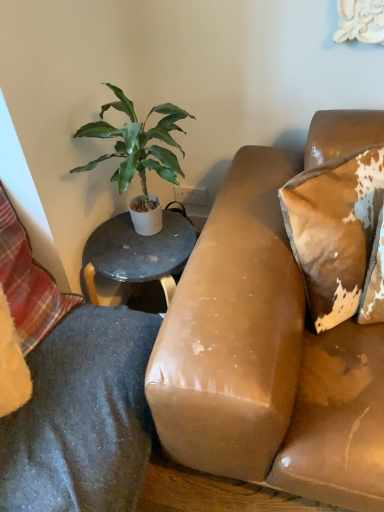
The width and height of the screenshot is (384, 512). Describe the element at coordinates (138, 144) in the screenshot. I see `green leafy plant at upper left` at that location.

This screenshot has width=384, height=512. I want to click on brown distressed leather pillow at upper right, placed as the 2th pillow when sorted from left to right, so click(x=335, y=230).

Where is `plaid fabric pillow at lower left, the 1th pillow viewed from the left`? The width and height of the screenshot is (384, 512). plaid fabric pillow at lower left, the 1th pillow viewed from the left is located at coordinates (28, 282).

Locate an element on the screen. green leafy plant at upper left is located at coordinates (138, 144).

Where is `houseplant above the brown distressed leather pillow at upper right, placed as the 2th pillow when sorted from left to right (from the image's perspective)`? The height and width of the screenshot is (512, 384). houseplant above the brown distressed leather pillow at upper right, placed as the 2th pillow when sorted from left to right (from the image's perspective) is located at coordinates (138, 144).

Can you tell me how much green leafy plant at upper left and brown distressed leather pillow at upper right, positioned as the first pillow in right-to-left order, differ in facing direction?

40.4 degrees.

Is green leafy plant at upper left positioned before brown distressed leather pillow at upper right, positioned as the first pillow in right-to-left order?

No, it is not.

From a real-world perspective, relative to brown distressed leather pillow at upper right, positioned as the first pillow in right-to-left order, is green leafy plant at upper left vertically above or below?

From a real-world perspective, green leafy plant at upper left is physically above brown distressed leather pillow at upper right, positioned as the first pillow in right-to-left order.

Do you think brown distressed leather pillow at upper right, positioned as the first pillow in right-to-left order, is within green leafy plant at upper left, or outside of it?

brown distressed leather pillow at upper right, positioned as the first pillow in right-to-left order, cannot be found inside green leafy plant at upper left.

Does brown distressed leather pillow at upper right, positioned as the first pillow in right-to-left order, appear on the left side of green leafy plant at upper left?

No, brown distressed leather pillow at upper right, positioned as the first pillow in right-to-left order, is not to the left of green leafy plant at upper left.

Is plaid fabric pillow at lower left, placed as the second pillow when sorted from right to left, far away from brown distressed leather pillow at upper right, positioned as the first pillow in right-to-left order?

No, plaid fabric pillow at lower left, placed as the second pillow when sorted from right to left, is not far from brown distressed leather pillow at upper right, positioned as the first pillow in right-to-left order.

Which is correct: plaid fabric pillow at lower left, placed as the second pillow when sorted from right to left, is inside brown distressed leather pillow at upper right, placed as the 2th pillow when sorted from left to right, or outside of it?

plaid fabric pillow at lower left, placed as the second pillow when sorted from right to left, exists outside the volume of brown distressed leather pillow at upper right, placed as the 2th pillow when sorted from left to right.

Does point (28, 266) lie behind point (307, 273)?

Yes, it is.

How far apart are plaid fabric pillow at lower left, placed as the second pillow when sorted from right to left, and brown distressed leather pillow at upper right, placed as the 2th pillow when sorted from left to right?

plaid fabric pillow at lower left, placed as the second pillow when sorted from right to left, is 28.39 inches away from brown distressed leather pillow at upper right, placed as the 2th pillow when sorted from left to right.

Is point (74, 168) closer or farther from the camera than point (0, 281)?

Clearly, point (74, 168) is more distant from the camera than point (0, 281).

Are green leafy plant at upper left and plaid fabric pillow at lower left, the 1th pillow viewed from the left, making contact?

No, green leafy plant at upper left is not next to plaid fabric pillow at lower left, the 1th pillow viewed from the left.

Is green leafy plant at upper left positioned with its back to plaid fabric pillow at lower left, the 1th pillow viewed from the left?

No, green leafy plant at upper left's orientation is not away from plaid fabric pillow at lower left, the 1th pillow viewed from the left.

Can you tell me how much green leafy plant at upper left and plaid fabric pillow at lower left, placed as the second pillow when sorted from right to left, differ in facing direction?

green leafy plant at upper left and plaid fabric pillow at lower left, placed as the second pillow when sorted from right to left, are facing 66 degrees away from each other.

Looking at their sizes, would you say plaid fabric pillow at lower left, the 1th pillow viewed from the left, is wider or thinner than green leafy plant at upper left?

Considering their sizes, plaid fabric pillow at lower left, the 1th pillow viewed from the left, looks slimmer than green leafy plant at upper left.

Is the position of plaid fabric pillow at lower left, the 1th pillow viewed from the left, more distant than that of green leafy plant at upper left?

No, it is not.

From a real-world perspective, does plaid fabric pillow at lower left, placed as the second pillow when sorted from right to left, sit lower than green leafy plant at upper left?

Yes, from a real-world perspective, plaid fabric pillow at lower left, placed as the second pillow when sorted from right to left, is under green leafy plant at upper left.

Considering the positions of objects brown distressed leather pillow at upper right, placed as the 2th pillow when sorted from left to right, and plaid fabric pillow at lower left, the 1th pillow viewed from the left, in the image provided, who is more to the right, brown distressed leather pillow at upper right, placed as the 2th pillow when sorted from left to right, or plaid fabric pillow at lower left, the 1th pillow viewed from the left,?

brown distressed leather pillow at upper right, placed as the 2th pillow when sorted from left to right, is more to the right.

Relative to plaid fabric pillow at lower left, the 1th pillow viewed from the left, is brown distressed leather pillow at upper right, positioned as the first pillow in right-to-left order, in front or behind?

brown distressed leather pillow at upper right, positioned as the first pillow in right-to-left order, is behind plaid fabric pillow at lower left, the 1th pillow viewed from the left.

The height and width of the screenshot is (512, 384). Identify the location of pillow below the brown distressed leather pillow at upper right, placed as the 2th pillow when sorted from left to right (from a real-world perspective). (28, 282).

From a real-world perspective, is brown distressed leather pillow at upper right, positioned as the first pillow in right-to-left order, beneath plaid fabric pillow at lower left, the 1th pillow viewed from the left?

No, from a real-world perspective, brown distressed leather pillow at upper right, positioned as the first pillow in right-to-left order, is not beneath plaid fabric pillow at lower left, the 1th pillow viewed from the left.

Locate an element on the screen. This screenshot has height=512, width=384. the 1st pillow below when counting from the green leafy plant at upper left (from the image's perspective) is located at coordinates (335, 230).

I want to click on houseplant above the brown distressed leather pillow at upper right, placed as the 2th pillow when sorted from left to right (from a real-world perspective), so click(138, 144).

Looking at the image, which one is located further to green leafy plant at upper left, plaid fabric pillow at lower left, the 1th pillow viewed from the left, or brown distressed leather pillow at upper right, positioned as the first pillow in right-to-left order?

Among the two, brown distressed leather pillow at upper right, positioned as the first pillow in right-to-left order, is located further to green leafy plant at upper left.

Estimate the real-world distances between objects in this image. Which object is closer to brown distressed leather pillow at upper right, positioned as the first pillow in right-to-left order, plaid fabric pillow at lower left, placed as the second pillow when sorted from right to left, or green leafy plant at upper left?

The object closer to brown distressed leather pillow at upper right, positioned as the first pillow in right-to-left order, is green leafy plant at upper left.

Looking at this image, which object lies nearer to the anchor point brown distressed leather pillow at upper right, placed as the 2th pillow when sorted from left to right, green leafy plant at upper left or plaid fabric pillow at lower left, placed as the second pillow when sorted from right to left?

green leafy plant at upper left.

Looking at the image, which one is located closer to plaid fabric pillow at lower left, placed as the second pillow when sorted from right to left, green leafy plant at upper left or brown distressed leather pillow at upper right, placed as the 2th pillow when sorted from left to right?

Among the two, green leafy plant at upper left is located nearer to plaid fabric pillow at lower left, placed as the second pillow when sorted from right to left.

Based on their spatial positions, is brown distressed leather pillow at upper right, positioned as the first pillow in right-to-left order, or plaid fabric pillow at lower left, the 1th pillow viewed from the left, further from green leafy plant at upper left?

Based on the image, brown distressed leather pillow at upper right, positioned as the first pillow in right-to-left order, appears to be further to green leafy plant at upper left.

When comparing their distances from plaid fabric pillow at lower left, the 1th pillow viewed from the left, does brown distressed leather pillow at upper right, positioned as the first pillow in right-to-left order, or green leafy plant at upper left seem closer?

Among the two, green leafy plant at upper left is located nearer to plaid fabric pillow at lower left, the 1th pillow viewed from the left.

I want to click on houseplant between plaid fabric pillow at lower left, placed as the second pillow when sorted from right to left, and brown distressed leather pillow at upper right, positioned as the first pillow in right-to-left order, in the horizontal direction, so click(138, 144).